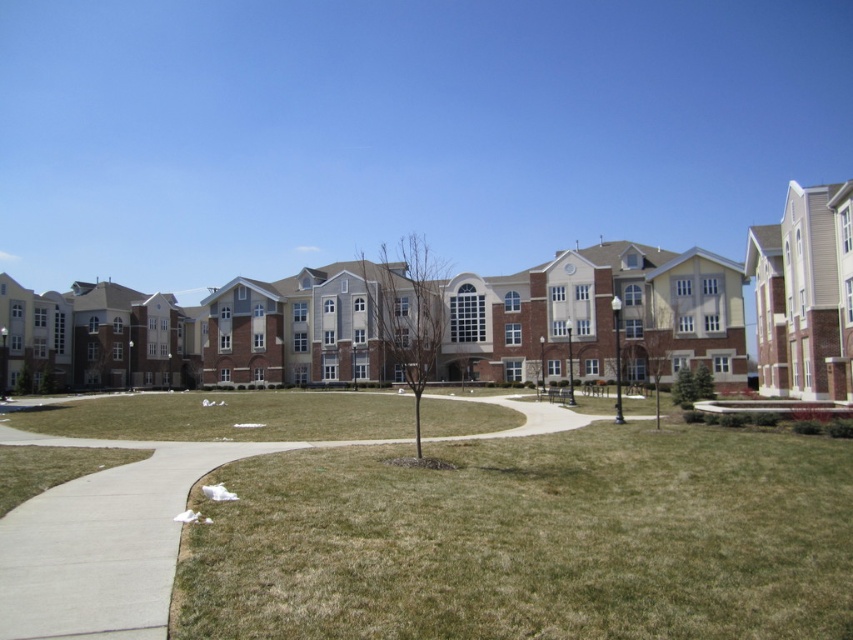
You are standing at the entrance of the building and see the green grass at lower center and the green grass at center. Which one is closer to you?

The green grass at lower center is closer to you because it is in front of the green grass at center.

You are standing at the entrance of the building complex and want to walk towards the two points marked in the image. Which point, point (837, 612) or point (410, 426), is closer to you?

Point (837, 612) is closer to the viewer than point (410, 426).

In the scene shown: You are a gardener who needs to mow the lawn. You see two areas of green grass at lower center and green grass at center. Which area requires mowing first based on their height?

The green grass at center requires mowing first because it is taller than the green grass at lower center.